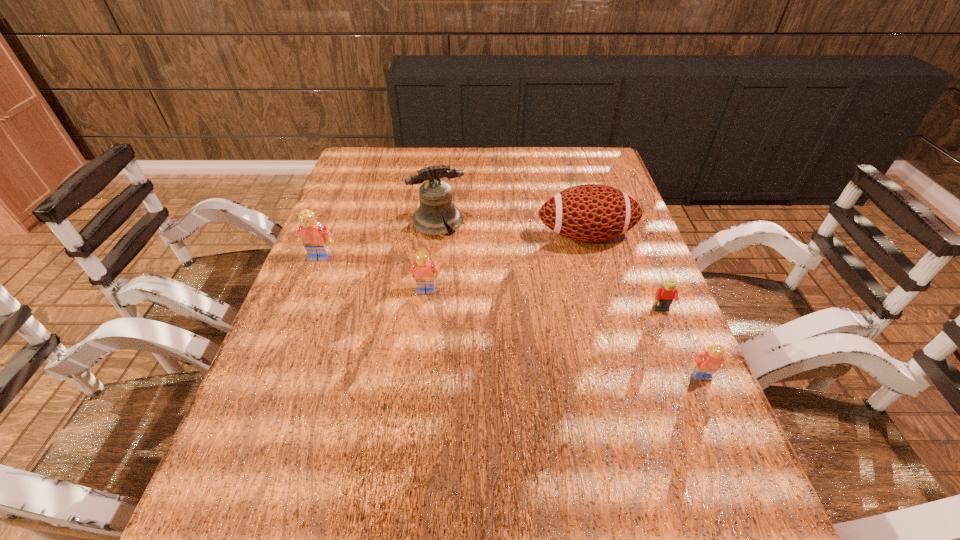
Locate an element on the screen. The height and width of the screenshot is (540, 960). vacant area located 0.190m on the front-facing side of the nearest Lego is located at coordinates (744, 476).

The width and height of the screenshot is (960, 540). Find the location of `blank space located 0.330m on the left of the football`. blank space located 0.330m on the left of the football is located at coordinates (419, 236).

Where is `free point located 0.310m on the right of the bell`? The width and height of the screenshot is (960, 540). free point located 0.310m on the right of the bell is located at coordinates (572, 224).

Where is `vacant space located on the face of the second nearest object`? This screenshot has height=540, width=960. vacant space located on the face of the second nearest object is located at coordinates (720, 460).

I want to click on object at the left edge, so click(315, 238).

Find the location of a particular element. The width and height of the screenshot is (960, 540). football at the right edge is located at coordinates (591, 212).

Identify the location of vacant area at the far edge. (502, 159).

You are a GUI agent. You are given a task and a screenshot of the screen. Output one action in this format:
    pyautogui.click(x=<x>, y=<y>)
    Task: Click on the free location at the near edge
    Image resolution: width=960 pixels, height=540 pixels.
    Given the screenshot: What is the action you would take?
    pyautogui.click(x=558, y=441)

This screenshot has height=540, width=960. I want to click on vacant space at the left edge, so click(348, 234).

I want to click on vacant space at the right edge of the desktop, so click(607, 265).